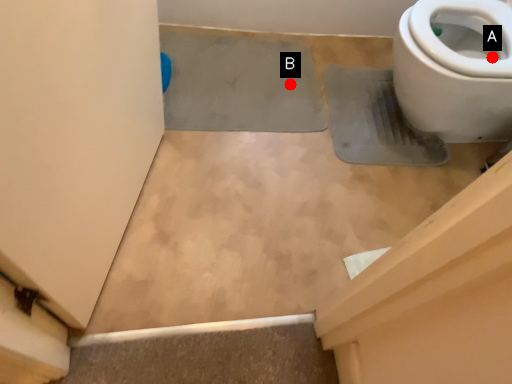
Question: Two points are circled on the image, labeled by A and B beside each circle. Among these points, which one is nearest to the camera?

Choices:
 (A) A is closer
 (B) B is closer

Answer: (A)